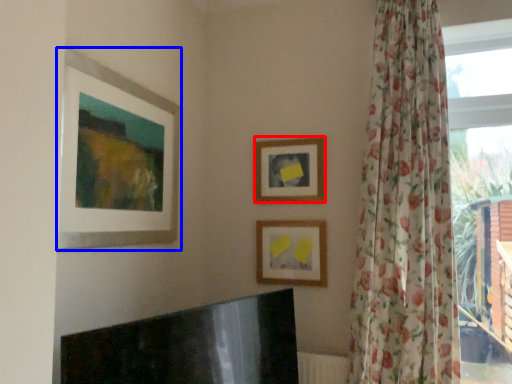
Question: Which point is further to the camera, picture frame (highlighted by a red box) or picture frame (highlighted by a blue box)?

Choices:
 (A) picture frame
 (B) picture frame

Answer: (A)